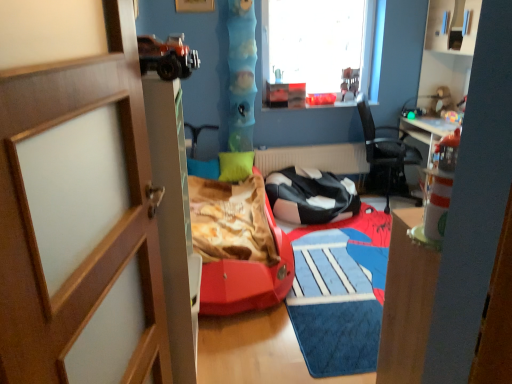
Find the location of a particular element. space that is in front of black leather chair at center, which is the 1th chair in left-to-right order is located at coordinates (334, 252).